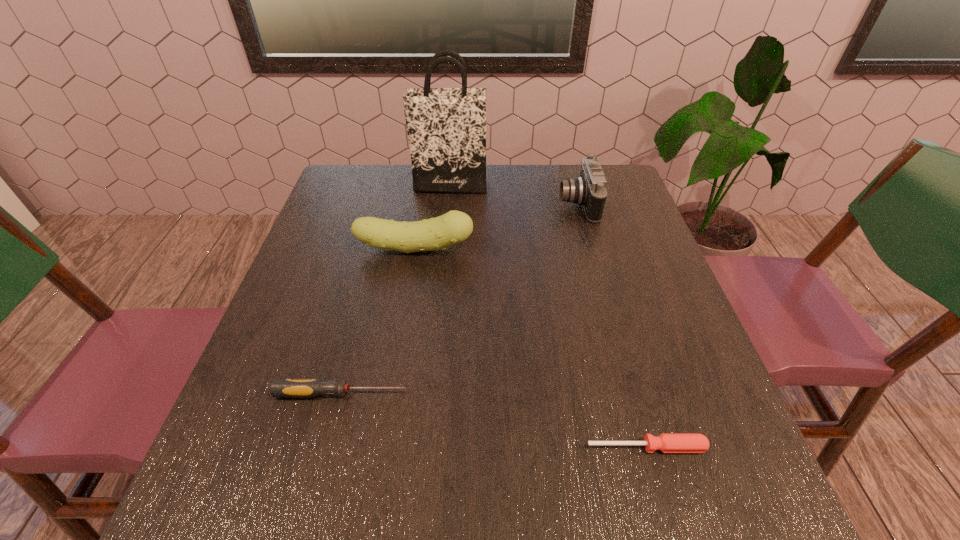
Locate an element on the screen. This screenshot has width=960, height=540. shopping bag is located at coordinates (446, 127).

You are a GUI agent. You are given a task and a screenshot of the screen. Output one action in this format:
    pyautogui.click(x=<x>, y=<y>)
    Task: Click on the camera
    This screenshot has height=540, width=960.
    Given the screenshot: What is the action you would take?
    pyautogui.click(x=589, y=190)

What are the coordinates of `cucumber` in the screenshot? It's located at (453, 227).

Find the location of a particular element. the fourth farthest object is located at coordinates (280, 388).

Where is `the taller screwdriver`? The height and width of the screenshot is (540, 960). the taller screwdriver is located at coordinates (280, 388).

Locate an element on the screen. the right screwdriver is located at coordinates (666, 442).

Identify the location of the shorter screwdriver. (666, 442).

This screenshot has height=540, width=960. I want to click on vacant space located on the front of the shopping bag with the design, so click(447, 206).

Where is `free spot located 0.180m on the front-facing side of the camera`? The width and height of the screenshot is (960, 540). free spot located 0.180m on the front-facing side of the camera is located at coordinates [495, 204].

You are a GUI agent. You are given a task and a screenshot of the screen. Output one action in this format:
    pyautogui.click(x=<x>, y=<y>)
    Task: Click on the free space located on the front-facing side of the camera
    
    Given the screenshot: What is the action you would take?
    pyautogui.click(x=474, y=204)